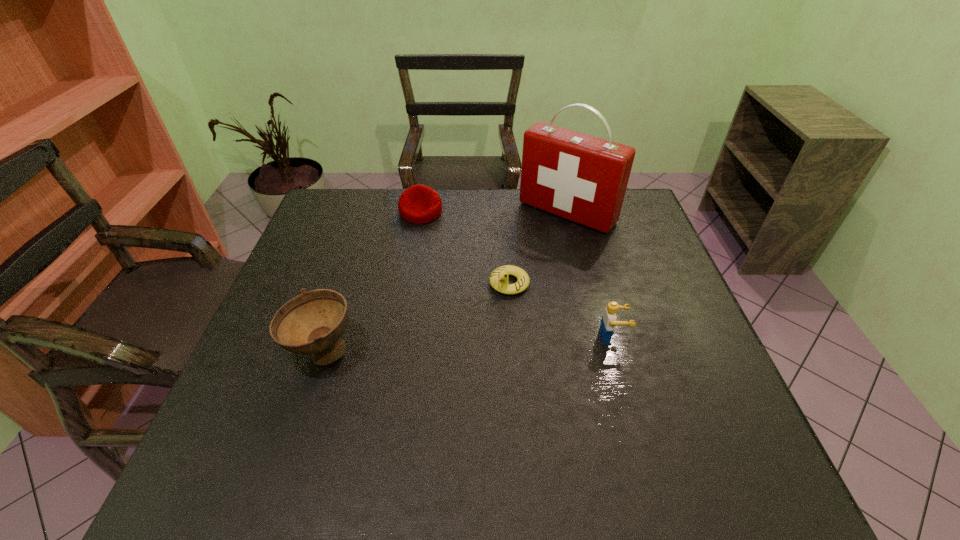
Identify the location of unoccupied area between the duckling and the second tallest object. This screenshot has width=960, height=540. (416, 318).

I want to click on free spot between the tallest object and the third tallest object, so click(x=589, y=275).

Image resolution: width=960 pixels, height=540 pixels. Find the location of `vacant region between the leftmost object and the tallest object`. vacant region between the leftmost object and the tallest object is located at coordinates (444, 283).

In order to click on empty space between the third farthest object and the tallest object in this screenshot , I will do `click(539, 248)`.

You are a GUI agent. You are given a task and a screenshot of the screen. Output one action in this format:
    pyautogui.click(x=<x>, y=<y>)
    Task: Click on the empty space that is in between the leftmost object and the fourth object from right to left
    This screenshot has width=960, height=540.
    Given the screenshot: What is the action you would take?
    pyautogui.click(x=372, y=282)

At what (x,y) coordinates should I click in order to perform the action: click on vacant space in between the beanbag and the soup bowl. Please return your answer as a coordinate pair (x, y). Looking at the image, I should click on (372, 282).

Locate an element on the screen. The image size is (960, 540). vacant area between the tallest object and the third tallest object is located at coordinates (589, 275).

Identify the location of blank region between the third tallest object and the leftmost object. The width and height of the screenshot is (960, 540). (468, 345).

Identify the location of free area in between the duckling and the tallest object. The image size is (960, 540). (539, 248).

You are a GUI agent. You are given a task and a screenshot of the screen. Output one action in this format:
    pyautogui.click(x=<x>, y=<y>)
    Task: Click on the object that is the closest to the tallest object
    The height and width of the screenshot is (540, 960).
    Given the screenshot: What is the action you would take?
    pyautogui.click(x=499, y=279)